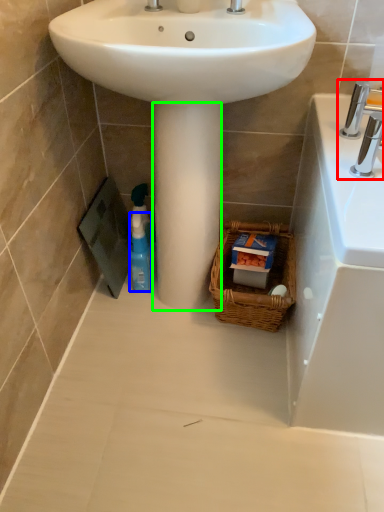
Question: Considering the real-world distances, which object is closest to tap (highlighted by a red box)? cleaning product (highlighted by a blue box) or pillar (highlighted by a green box).

Choices:
 (A) cleaning product
 (B) pillar

Answer: (B)